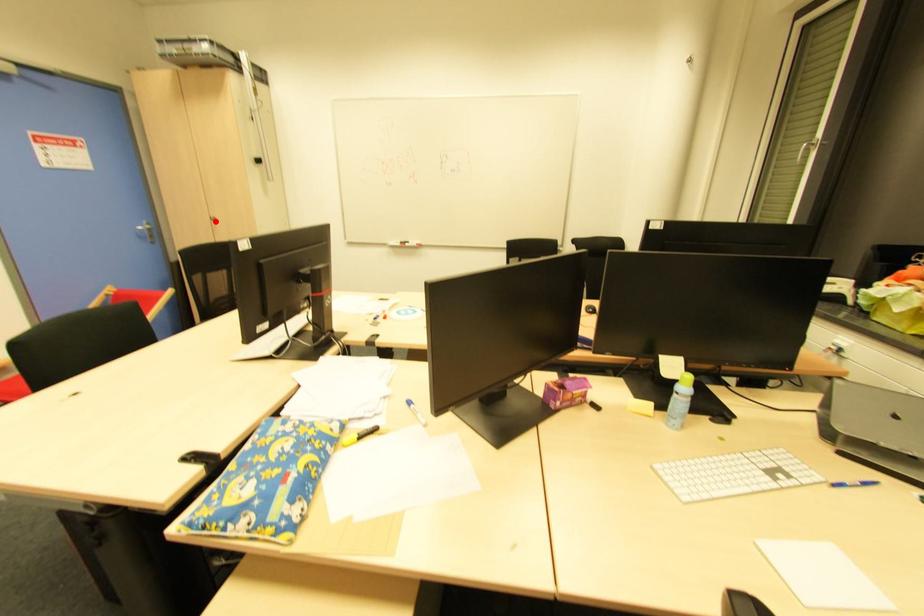
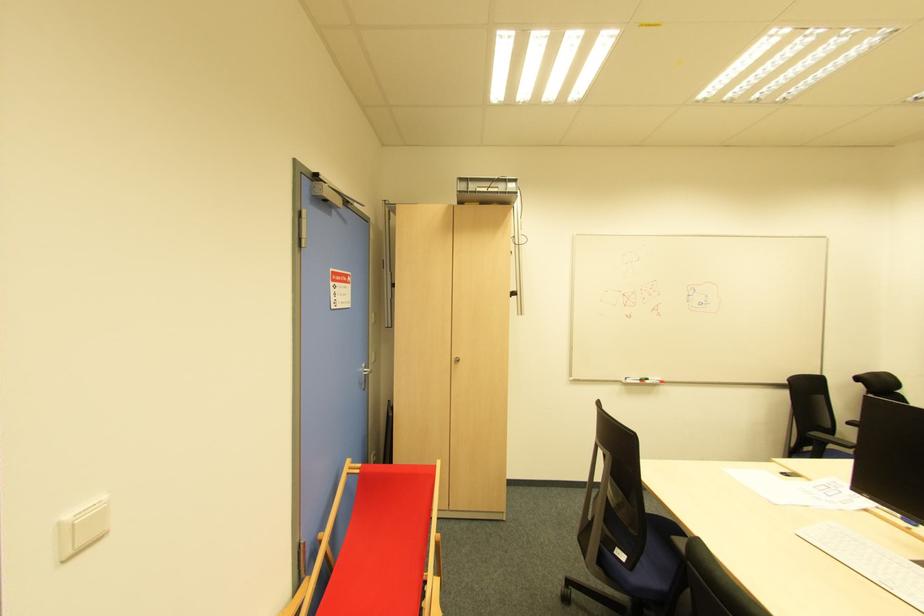
Find the pixel in the second image that matches the highlighted location in the first image.

(457, 362)